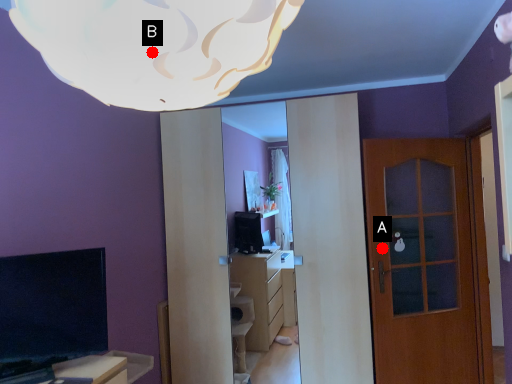
Question: Two points are circled on the image, labeled by A and B beside each circle. Which point is closer to the camera?

Choices:
 (A) A is closer
 (B) B is closer

Answer: (B)